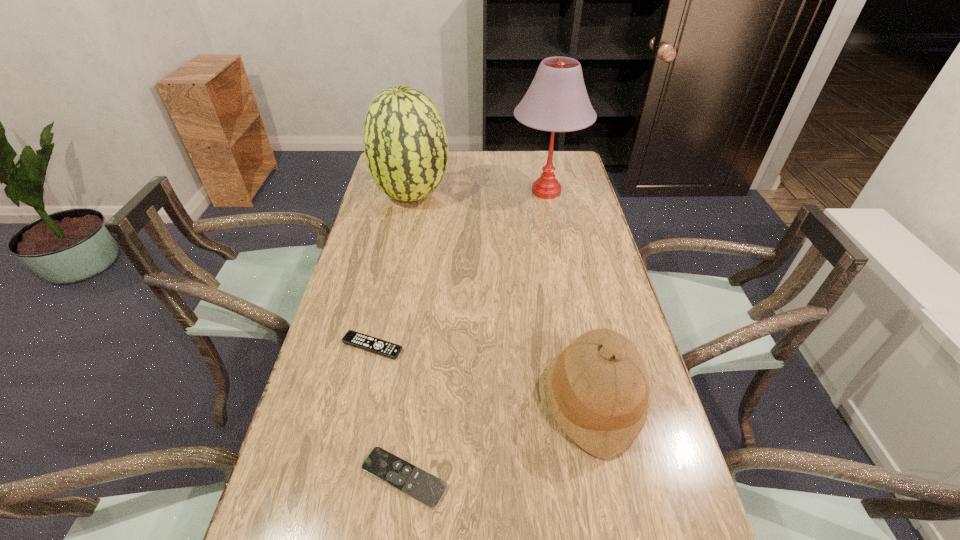
Locate an element on the screen. This screenshot has width=960, height=540. the tallest object is located at coordinates (557, 101).

You are a GUI agent. You are given a task and a screenshot of the screen. Output one action in this format:
    pyautogui.click(x=<x>, y=<y>)
    Task: Click on the second tallest object
    The width and height of the screenshot is (960, 540).
    Given the screenshot: What is the action you would take?
    [405, 143]

Find the location of a particular element. The width and height of the screenshot is (960, 540). hat is located at coordinates (597, 388).

Where is `the second shortest object`? This screenshot has height=540, width=960. the second shortest object is located at coordinates (353, 338).

This screenshot has height=540, width=960. Identify the location of the farther remote control. (353, 338).

Where is `the shortest object`? The width and height of the screenshot is (960, 540). the shortest object is located at coordinates (416, 483).

You are a GUI agent. You are given a task and a screenshot of the screen. Output one action in this format:
    pyautogui.click(x=<x>, y=<y>)
    Task: Click on the nearer remote control
    This screenshot has width=960, height=540.
    Given the screenshot: What is the action you would take?
    pyautogui.click(x=416, y=483)

At what (x,y) coordinates should I click in order to perform the action: click on blank space located 0.140m on the front-facing side of the tallest object. Please return your answer as a coordinate pair (x, y). The height and width of the screenshot is (540, 960). Looking at the image, I should click on (555, 236).

Where is `vacant space located on the front of the watermelon`? This screenshot has width=960, height=540. vacant space located on the front of the watermelon is located at coordinates (395, 280).

You are a GUI agent. You are given a task and a screenshot of the screen. Output one action in this format:
    pyautogui.click(x=<x>, y=<y>)
    Task: Click on the vacant position located 0.270m on the front-facing side of the third shortest object
    Image resolution: width=960 pixels, height=540 pixels.
    Given the screenshot: What is the action you would take?
    pyautogui.click(x=428, y=400)